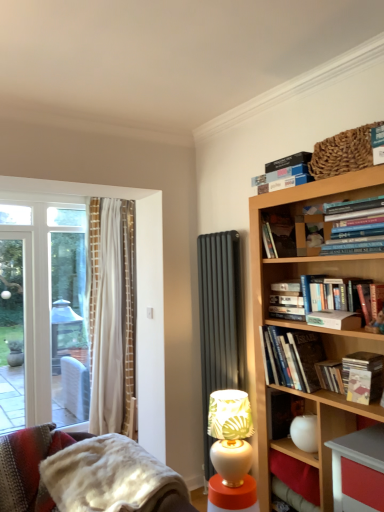
Where is `blank space situated above hardcover book at upper right, which is the second paperback book from top to bottom (from a real-world perspective)`? The width and height of the screenshot is (384, 512). blank space situated above hardcover book at upper right, which is the second paperback book from top to bottom (from a real-world perspective) is located at coordinates 343,307.